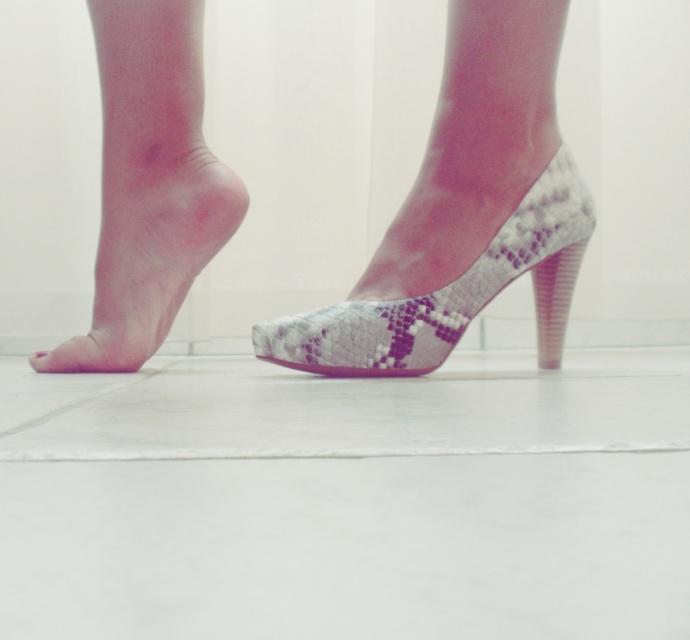
Question: Based on their relative distances, which object is farther from the pink smooth skin at lower left?

Choices:
 (A) snake skin high heel at center
 (B) snake skin sock at center
 (C) snake skin high heel at lower right

Answer: (B)

Question: Does pink smooth skin at lower left have a greater width compared to snake skin high heel at center?

Choices:
 (A) yes
 (B) no

Answer: (B)

Question: Which of these objects is positioned farthest from the snake skin high heel at lower right?

Choices:
 (A) snake skin high heel at center
 (B) pink smooth skin at lower left
 (C) snake skin sock at center

Answer: (A)

Question: Which point is closer to the camera taking this photo?

Choices:
 (A) (431, 220)
 (B) (540, 248)
 (C) (486, 3)
 (D) (230, 180)

Answer: (C)

Question: Does pink smooth skin at lower left appear on the right side of snake skin high heel at center?

Choices:
 (A) no
 (B) yes

Answer: (A)

Question: Does snake skin high heel at lower right have a greater width compared to snake skin high heel at center?

Choices:
 (A) yes
 (B) no

Answer: (A)